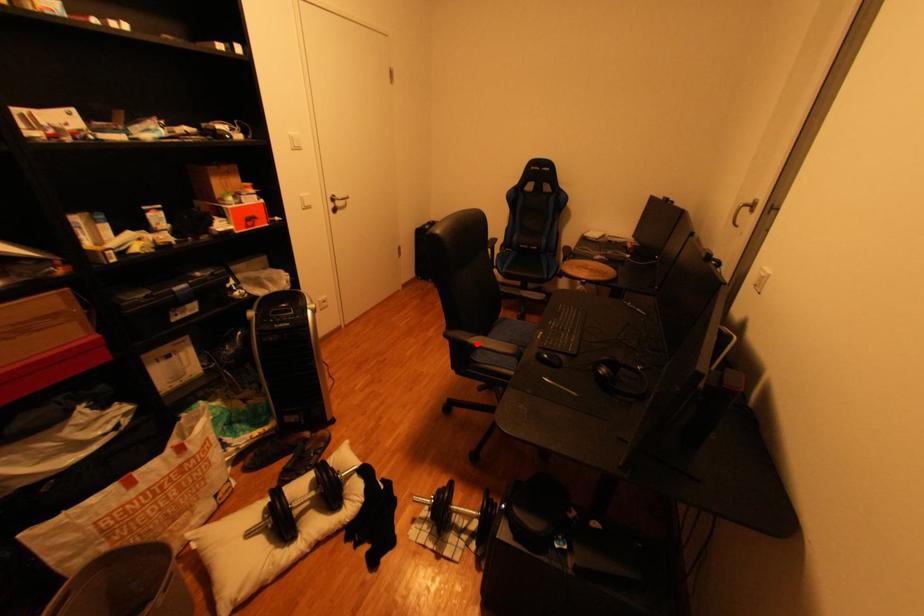
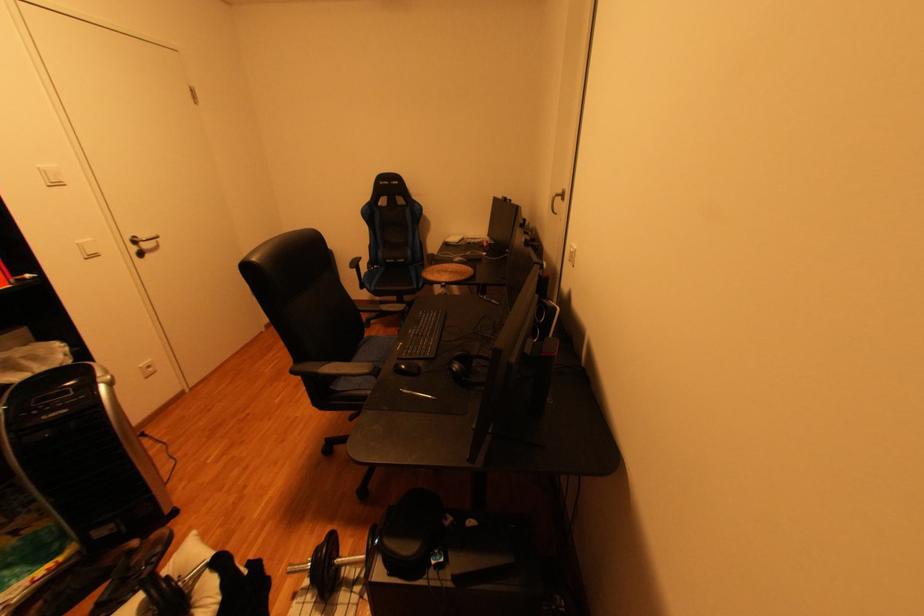
Question: I am providing you with two images of the same scene from different viewpoints. Image1 has a red point marked. In image2, the corresponding 3D location appears at what relative position? Reply with the corresponding letter.

Choices:
 (A) Closer
 (B) Farther

Answer: (A)